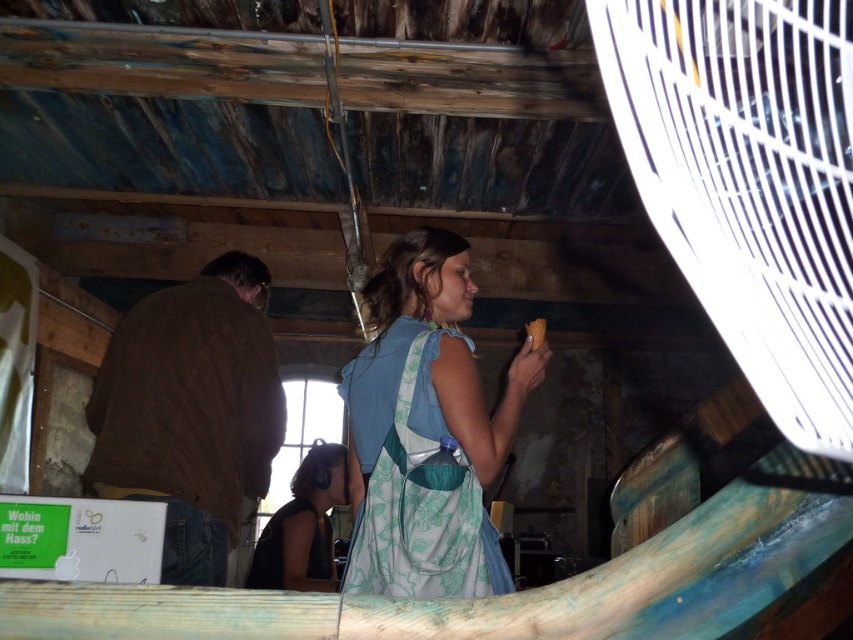
You are organizing a photoshoot in this rustic wooden structure and need to position a model wearing the light blue fabric dress at center and a prop made of dark blue fabric at lower center. Based on the scene description, which object occupies more vertical space in the image?

The light blue fabric dress at center is taller than the dark blue fabric at lower center, so it occupies more vertical space.

You are standing in the rustic wooden structure and want to hang a new coat on the brown leather jacket at left. However, there is a white plastic fan at upper right in the way. Can you hang the coat without moving the fan?

The white plastic fan at upper right is in front of the brown leather jacket at left, so you cannot hang the coat on the brown leather jacket at left without moving the fan first.